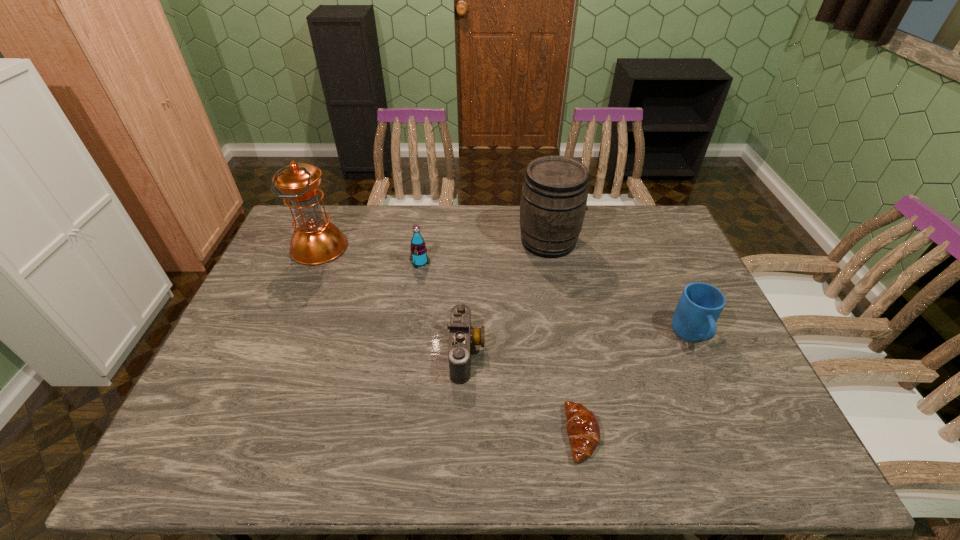
Locate an element on the screen. The width and height of the screenshot is (960, 540). object that is at the far left corner is located at coordinates (316, 241).

Locate an element on the screen. The width and height of the screenshot is (960, 540). free space at the far edge is located at coordinates (611, 206).

In the image, there is a desktop. Where is `free region at the near edge`? This screenshot has width=960, height=540. free region at the near edge is located at coordinates (360, 464).

Find the location of `free region at the left edge of the desktop`. free region at the left edge of the desktop is located at coordinates (242, 356).

At what (x,y) coordinates should I click in order to perform the action: click on free region at the right edge of the desktop. Please return your answer as a coordinate pair (x, y). The image size is (960, 540). Looking at the image, I should click on (643, 251).

Where is `vacant space at the near right corner of the desktop`? Image resolution: width=960 pixels, height=540 pixels. vacant space at the near right corner of the desktop is located at coordinates (780, 450).

The image size is (960, 540). I want to click on vacant space that is in between the soda and the camera, so click(x=444, y=307).

Locate an element on the screen. unoccupied area between the soda and the oil lamp is located at coordinates (370, 255).

Locate an element on the screen. The image size is (960, 540). unoccupied position between the wine bucket and the camera is located at coordinates (508, 297).

Identify the location of vacant area that lies between the crescent roll and the fourth object from right to left. The image size is (960, 540). (524, 393).